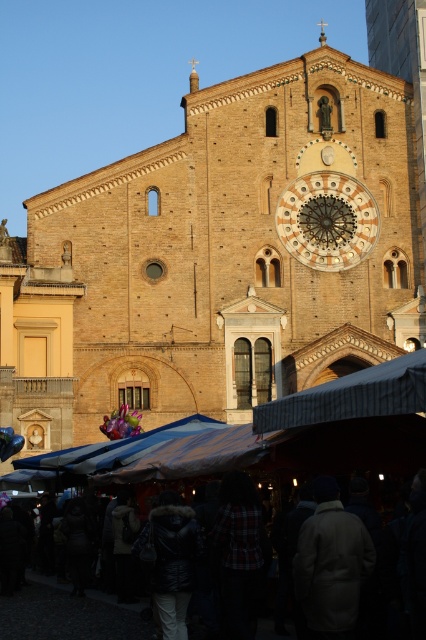
Question: Does golden textured clock at center have a larger size compared to dark woolen coat at lower center?

Choices:
 (A) yes
 (B) no

Answer: (B)

Question: Which object appears farthest from the camera in this image?

Choices:
 (A) black fur-lined coat at center
 (B) brown brick church at center

Answer: (B)

Question: Which of the following is the farthest from the observer?

Choices:
 (A) (276, 230)
 (B) (190, 637)
 (C) (362, 570)
 (D) (348, 403)

Answer: (A)

Question: Can you confirm if golden textured clock at center is bigger than black fur-lined coat at center?

Choices:
 (A) no
 (B) yes

Answer: (B)

Question: Can you confirm if white wool coat at lower right is smaller than dark woolen coat at lower center?

Choices:
 (A) no
 (B) yes

Answer: (B)

Question: Which object is the closest to the gray striped canopy at center?

Choices:
 (A) white wool coat at lower right
 (B) dark woolen coat at lower center
 (C) black fur-lined coat at center

Answer: (A)